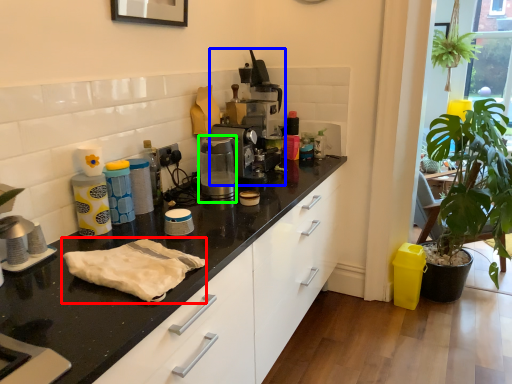
Question: Estimate the real-world distances between objects in this image. Which object is farther from material (highlighted by a red box), coffee machine (highlighted by a blue box) or coffee machine (highlighted by a green box)?

Choices:
 (A) coffee machine
 (B) coffee machine

Answer: (A)